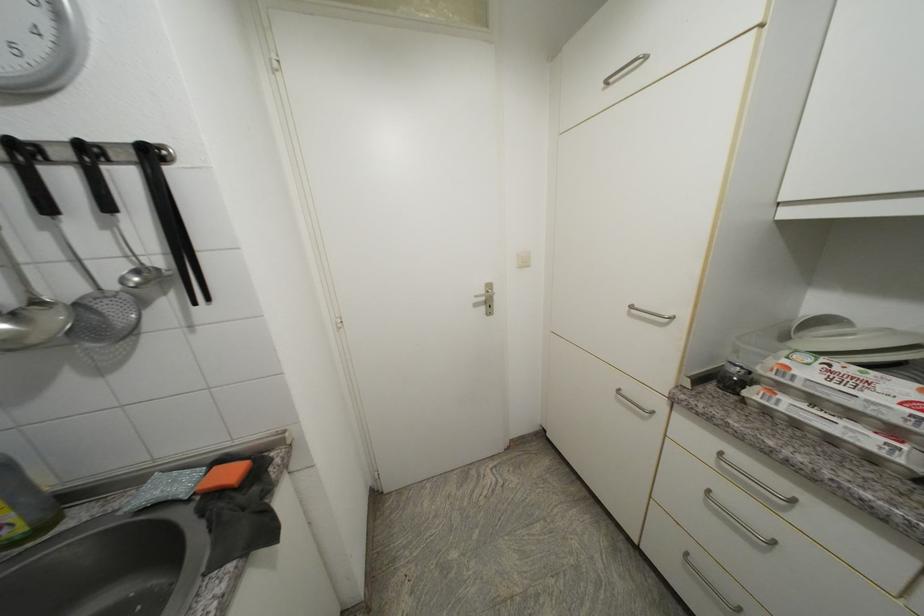
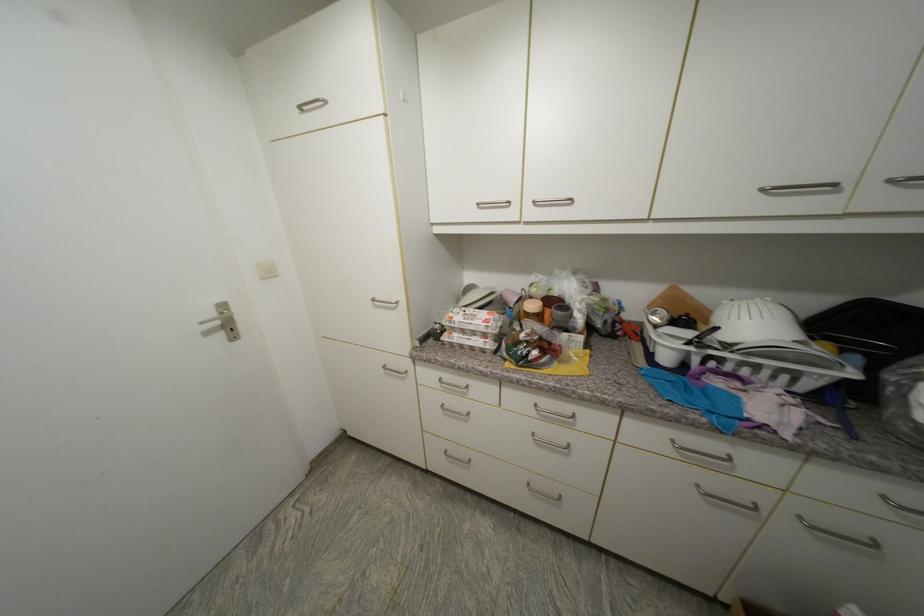
Question: The first image is from the beginning of the video and the second image is from the end. How did the camera likely rotate when shooting the video?

Choices:
 (A) Left
 (B) Right
 (C) Up
 (D) Down

Answer: (B)